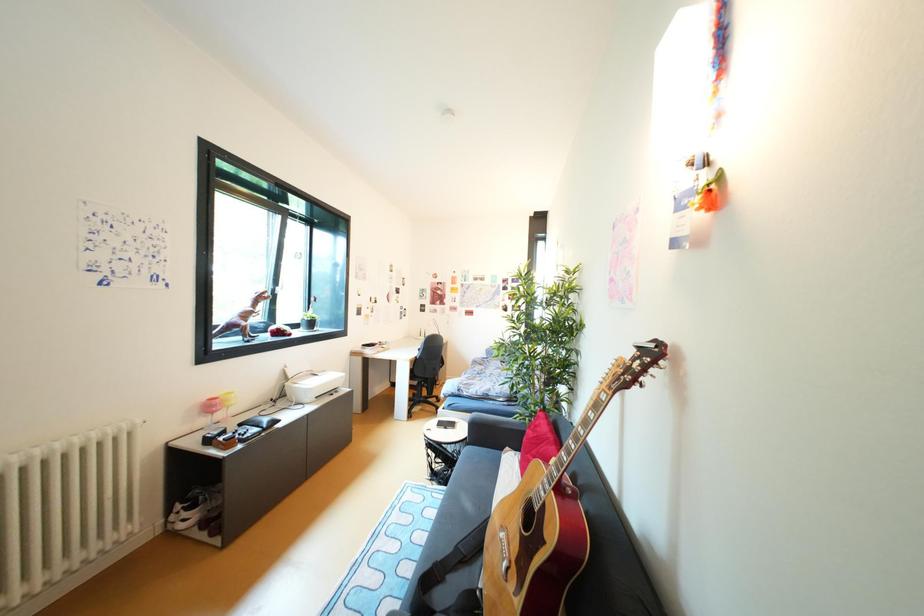
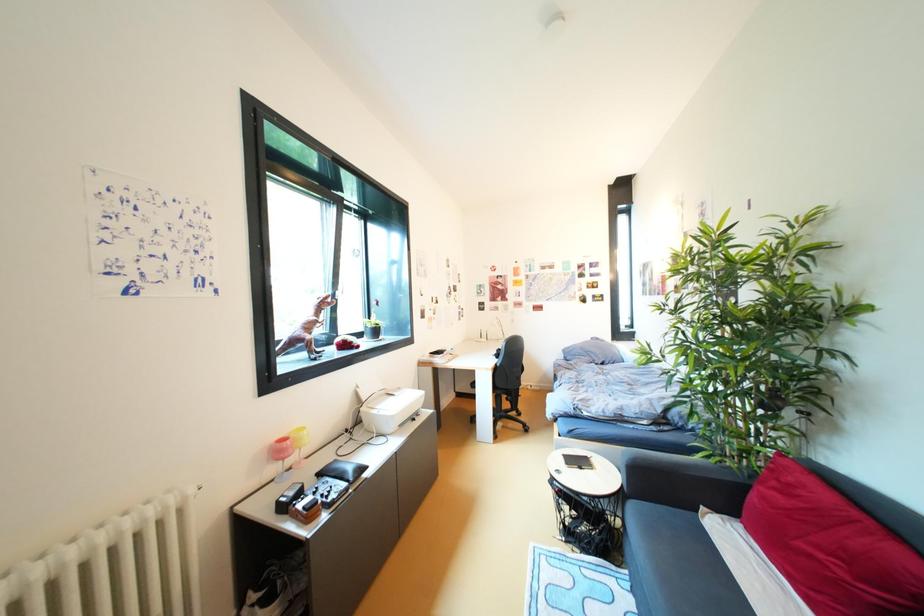
Question: How did the camera likely rotate?

Choices:
 (A) Left
 (B) Right
 (C) Up
 (D) Down

Answer: (A)